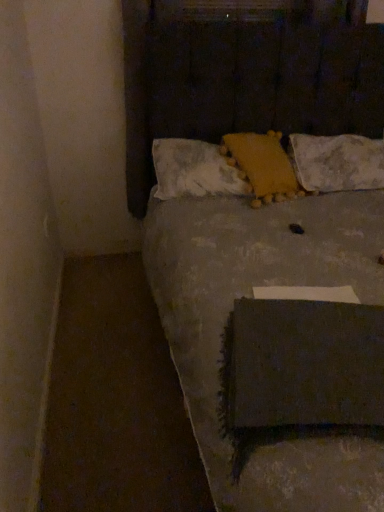
What do you see at coordinates (262, 166) in the screenshot? This screenshot has height=512, width=384. I see `yellow fuzzy pillow at center, which is the second pillow in right-to-left order` at bounding box center [262, 166].

At what (x,y) coordinates should I click in order to perform the action: click on yellow textured pillow at center, the third pillow when ordered from right to left. Please return your answer as a coordinate pair (x, y). Image resolution: width=384 pixels, height=512 pixels. Looking at the image, I should click on (194, 170).

Which is closer, [369,147] or [285,154]?

Clearly, point [369,147] is more distant from the camera than point [285,154].

From a real-world perspective, between white textured pillow at upper center, placed as the 3th pillow when sorted from left to right, and yellow fuzzy pillow at center, which is the second pillow in right-to-left order, who is vertically lower?

In real-world perspective, white textured pillow at upper center, placed as the 3th pillow when sorted from left to right, is lower.

From the image's perspective, between white textured pillow at upper center, which is counted as the 1th pillow, starting from the right, and yellow fuzzy pillow at center, which is the second pillow in right-to-left order, which one is located above?

white textured pillow at upper center, which is counted as the 1th pillow, starting from the right.

Is white textured pillow at upper center, placed as the 3th pillow when sorted from left to right, positioned with its back to yellow fuzzy pillow at center, which is the second pillow in right-to-left order?

No.

From the image's perspective, is textured gray bed at center over yellow fuzzy pillow at center, which is counted as the 2th pillow, starting from the left?

No.

Measure the distance between textured gray bed at center and yellow fuzzy pillow at center, which is counted as the 2th pillow, starting from the left.

textured gray bed at center and yellow fuzzy pillow at center, which is counted as the 2th pillow, starting from the left, are 14.22 inches apart.

Is point (319, 465) behind point (252, 190)?

No.

Is textured gray bed at center inside the boundaries of yellow fuzzy pillow at center, which is the second pillow in right-to-left order, or outside?

textured gray bed at center lies outside yellow fuzzy pillow at center, which is the second pillow in right-to-left order.

Based on the photo, is textured gray bed at center positioned beyond the bounds of yellow textured pillow at center, which ranks as the first pillow in left-to-right order?

Yes.

Does textured gray bed at center have a larger size compared to yellow textured pillow at center, the third pillow when ordered from right to left?

Yes.

Does point (166, 21) lie behind point (161, 198)?

That is False.

Is textured gray bed at center in front of yellow textured pillow at center, which ranks as the first pillow in left-to-right order?

Yes, it is.

Is point (305, 136) closer to viewer compared to point (336, 202)?

No.

Does white textured pillow at upper center, which is counted as the 1th pillow, starting from the right, appear on the left side of textured gray bed at center?

No.

Is white textured pillow at upper center, placed as the 3th pillow when sorted from left to right, smaller than textured gray bed at center?

Yes.

Is white textured pillow at upper center, which is counted as the 1th pillow, starting from the right, oriented away from textured gray bed at center?

Correct, white textured pillow at upper center, which is counted as the 1th pillow, starting from the right, is looking away from textured gray bed at center.

Are yellow textured pillow at center, which ranks as the first pillow in left-to-right order, and textured gray bed at center beside each other?

No, yellow textured pillow at center, which ranks as the first pillow in left-to-right order, is not in contact with textured gray bed at center.

Is yellow textured pillow at center, which ranks as the first pillow in left-to-right order, positioned in front of textured gray bed at center?

No, yellow textured pillow at center, which ranks as the first pillow in left-to-right order, is behind textured gray bed at center.

Is textured gray bed at center at the back of yellow textured pillow at center, which ranks as the first pillow in left-to-right order?

Yes.

Where is `bed in front of the yellow textured pillow at center, the third pillow when ordered from right to left`? This screenshot has width=384, height=512. bed in front of the yellow textured pillow at center, the third pillow when ordered from right to left is located at coordinates (244, 303).

Is yellow textured pillow at center, the third pillow when ordered from right to left, aimed at yellow fuzzy pillow at center, which is the second pillow in right-to-left order?

Yes.

From the image's perspective, which is below, yellow textured pillow at center, the third pillow when ordered from right to left, or yellow fuzzy pillow at center, which is the second pillow in right-to-left order?

From the image's view, yellow textured pillow at center, the third pillow when ordered from right to left, is below.

Is point (186, 139) closer to viewer compared to point (238, 135)?

No, (186, 139) is further to viewer.

Which is in front, point (278, 173) or point (253, 31)?

The point (278, 173) is in front.

Does yellow fuzzy pillow at center, which is counted as the 2th pillow, starting from the left, touch textured gray bed at center?

yellow fuzzy pillow at center, which is counted as the 2th pillow, starting from the left, is not next to textured gray bed at center, and they're not touching.

Image resolution: width=384 pixels, height=512 pixels. In order to click on bed that is under the yellow fuzzy pillow at center, which is the second pillow in right-to-left order (from a real-world perspective) in this screenshot , I will do `click(244, 303)`.

Can we say yellow fuzzy pillow at center, which is the second pillow in right-to-left order, lies outside textured gray bed at center?

No, most part of yellow fuzzy pillow at center, which is the second pillow in right-to-left order, lies within textured gray bed at center.

From a real-world perspective, starting from the yellow fuzzy pillow at center, which is counted as the 2th pillow, starting from the left, which pillow is the 2nd one below it? Please provide its 2D coordinates.

[(337, 162)]

Where is `the 2nd pillow above the textured gray bed at center (from a real-world perspective)`? the 2nd pillow above the textured gray bed at center (from a real-world perspective) is located at coordinates (262, 166).

Estimate the real-world distances between objects in this image. Which object is closer to white textured pillow at upper center, placed as the 3th pillow when sorted from left to right, textured gray bed at center or yellow fuzzy pillow at center, which is counted as the 2th pillow, starting from the left?

yellow fuzzy pillow at center, which is counted as the 2th pillow, starting from the left, is positioned closer to the anchor white textured pillow at upper center, placed as the 3th pillow when sorted from left to right.

Which object lies nearer to the anchor point yellow fuzzy pillow at center, which is counted as the 2th pillow, starting from the left, textured gray bed at center or white textured pillow at upper center, which is counted as the 1th pillow, starting from the right?

white textured pillow at upper center, which is counted as the 1th pillow, starting from the right, lies closer to yellow fuzzy pillow at center, which is counted as the 2th pillow, starting from the left, than the other object.

Looking at the image, which one is located further to textured gray bed at center, white textured pillow at upper center, placed as the 3th pillow when sorted from left to right, or yellow textured pillow at center, the third pillow when ordered from right to left?

Based on the image, white textured pillow at upper center, placed as the 3th pillow when sorted from left to right, appears to be further to textured gray bed at center.

Based on their spatial positions, is yellow fuzzy pillow at center, which is the second pillow in right-to-left order, or textured gray bed at center closer to white textured pillow at upper center, which is counted as the 1th pillow, starting from the right?

yellow fuzzy pillow at center, which is the second pillow in right-to-left order, is closer to white textured pillow at upper center, which is counted as the 1th pillow, starting from the right.

Estimate the real-world distances between objects in this image. Which object is further from yellow fuzzy pillow at center, which is the second pillow in right-to-left order, white textured pillow at upper center, placed as the 3th pillow when sorted from left to right, or yellow textured pillow at center, which ranks as the first pillow in left-to-right order?

Based on the image, white textured pillow at upper center, placed as the 3th pillow when sorted from left to right, appears to be further to yellow fuzzy pillow at center, which is the second pillow in right-to-left order.

Looking at the image, which one is located further to textured gray bed at center, white textured pillow at upper center, placed as the 3th pillow when sorted from left to right, or yellow fuzzy pillow at center, which is counted as the 2th pillow, starting from the left?

white textured pillow at upper center, placed as the 3th pillow when sorted from left to right, lies further to textured gray bed at center than the other object.

Considering their positions, is textured gray bed at center positioned closer to yellow textured pillow at center, which ranks as the first pillow in left-to-right order, than white textured pillow at upper center, which is counted as the 1th pillow, starting from the right?

textured gray bed at center lies closer to yellow textured pillow at center, which ranks as the first pillow in left-to-right order, than the other object.

Based on their spatial positions, is white textured pillow at upper center, placed as the 3th pillow when sorted from left to right, or textured gray bed at center further from yellow fuzzy pillow at center, which is the second pillow in right-to-left order?

textured gray bed at center is positioned further to the anchor yellow fuzzy pillow at center, which is the second pillow in right-to-left order.

At what (x,y) coordinates should I click in order to perform the action: click on pillow between textured gray bed at center and yellow textured pillow at center, which ranks as the first pillow in left-to-right order, along the z-axis. Please return your answer as a coordinate pair (x, y). This screenshot has height=512, width=384. Looking at the image, I should click on (x=262, y=166).

This screenshot has height=512, width=384. Find the location of `pillow situated between yellow textured pillow at center, which ranks as the first pillow in left-to-right order, and white textured pillow at upper center, placed as the 3th pillow when sorted from left to right, from left to right`. pillow situated between yellow textured pillow at center, which ranks as the first pillow in left-to-right order, and white textured pillow at upper center, placed as the 3th pillow when sorted from left to right, from left to right is located at coordinates (x=262, y=166).